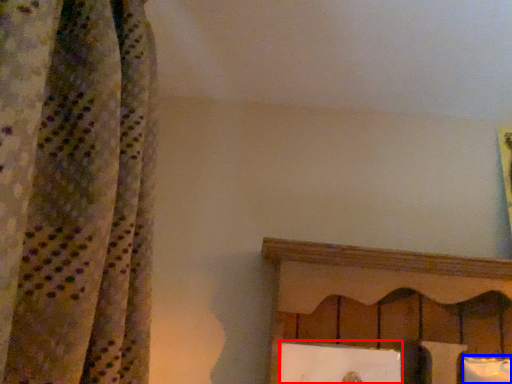
Question: Which object appears farthest to the camera in this image, picture frame (highlighted by a red box) or pillow (highlighted by a blue box)?

Choices:
 (A) picture frame
 (B) pillow

Answer: (B)